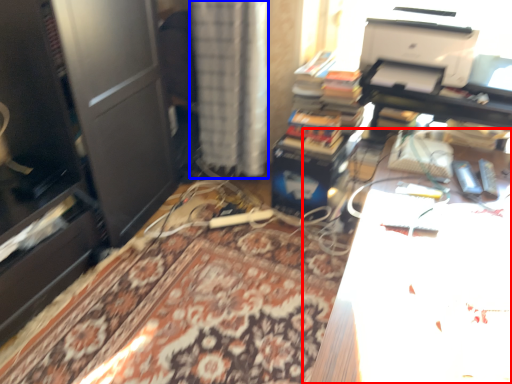
Question: Among these objects, which one is farthest to the camera, table (highlighted by a red box) or curtain (highlighted by a blue box)?

Choices:
 (A) table
 (B) curtain

Answer: (B)